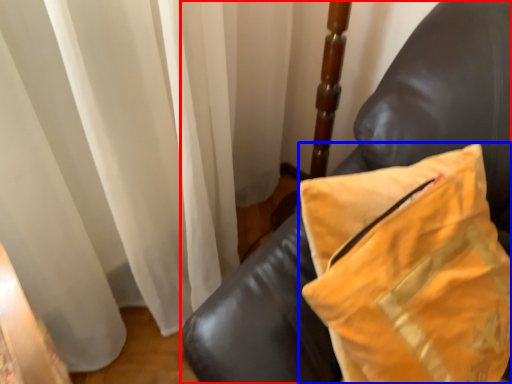
Question: Among these objects, which one is nearest to the camera, furniture (highlighted by a red box) or pillow (highlighted by a blue box)?

Choices:
 (A) furniture
 (B) pillow

Answer: (B)